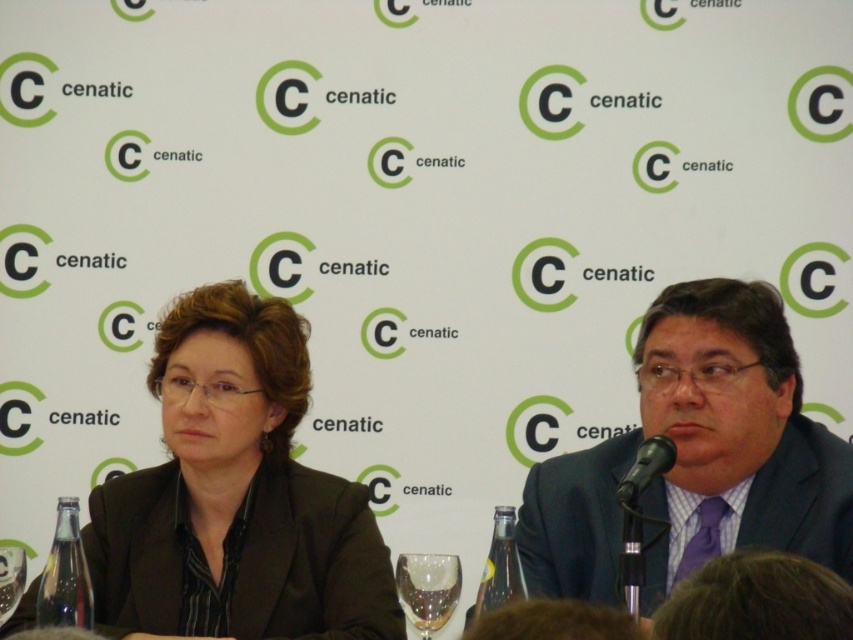
In the scene shown: You are a photographer at a press conference and need to capture a closeup of the transparent glass at center without including the matte black blazer at center in the shot. Given their positions, is this possible?

The matte black blazer at center is to the left of the transparent glass at center, so if you position your camera to the right side of the transparent glass at center and frame the shot to exclude the area where the matte black blazer at center is located, it should be possible to capture the transparent glass at center without including the matte black blazer at center.

You are organizing a small event and need to decide if the matte black suit at center can be placed on a shelf that can hold items up to the size of the black plastic microphone at lower right. Based on the scene description, will it fit?

The matte black suit at center is bigger than the black plastic microphone at lower right, so it will not fit on the shelf designed for items up to the size of the black plastic microphone at lower right.